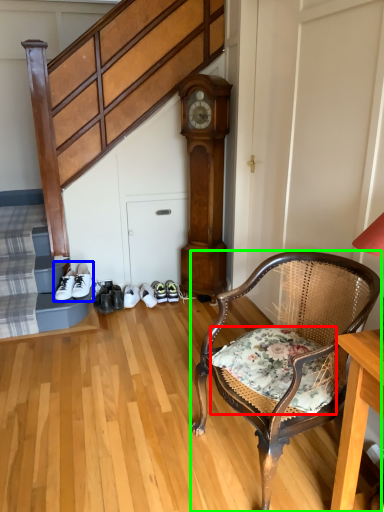
Question: Considering the real-world distances, which object is closest to pillow (highlighted by a red box)? footwear (highlighted by a blue box) or chair (highlighted by a green box).

Choices:
 (A) footwear
 (B) chair

Answer: (B)